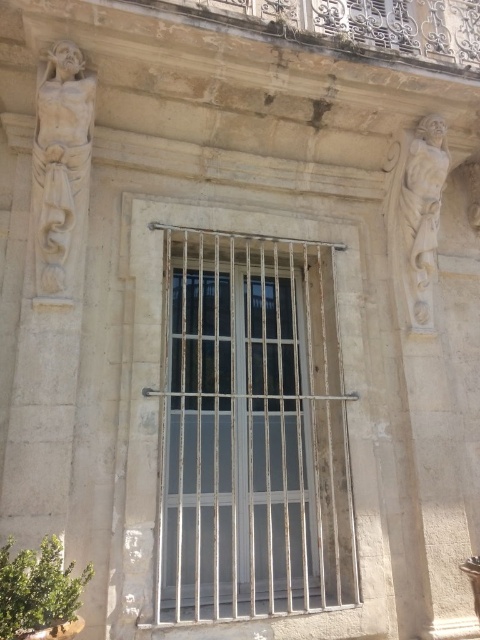
Question: Which of the following is the closest to the observer?

Choices:
 (A) (93, 115)
 (B) (440, 124)

Answer: (A)

Question: Can you confirm if white marble statue at left is positioned to the left of white stone statue at right?

Choices:
 (A) no
 (B) yes

Answer: (B)

Question: Can you confirm if metallic bars at center is thinner than white marble statue at left?

Choices:
 (A) no
 (B) yes

Answer: (A)

Question: Can you confirm if metallic bars at center is thinner than white stone statue at right?

Choices:
 (A) no
 (B) yes

Answer: (A)

Question: Which is farther from the white stone statue at right?

Choices:
 (A) metallic bars at center
 (B) white marble statue at left

Answer: (B)

Question: Considering the real-world distances, which object is closest to the white marble statue at left?

Choices:
 (A) metallic bars at center
 (B) white stone statue at right

Answer: (A)